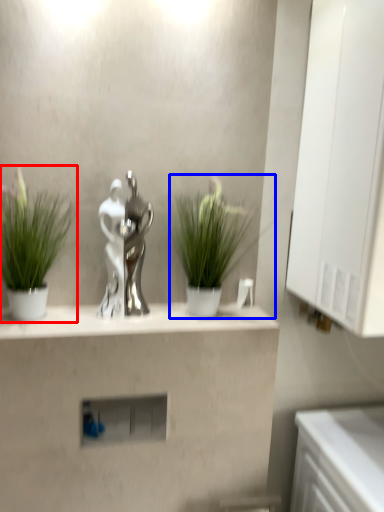
Question: Which of the following is the farthest to the observer, houseplant (highlighted by a red box) or houseplant (highlighted by a blue box)?

Choices:
 (A) houseplant
 (B) houseplant

Answer: (B)